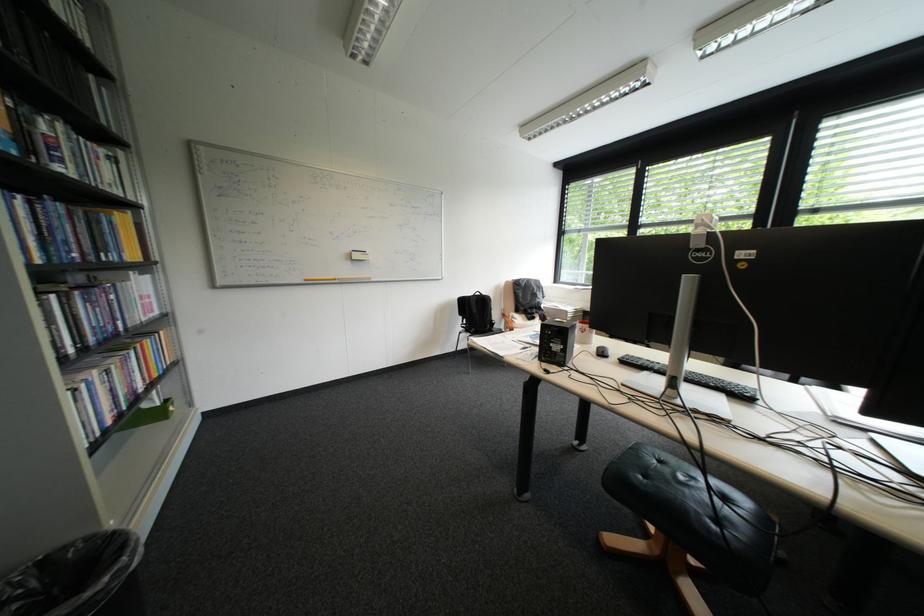
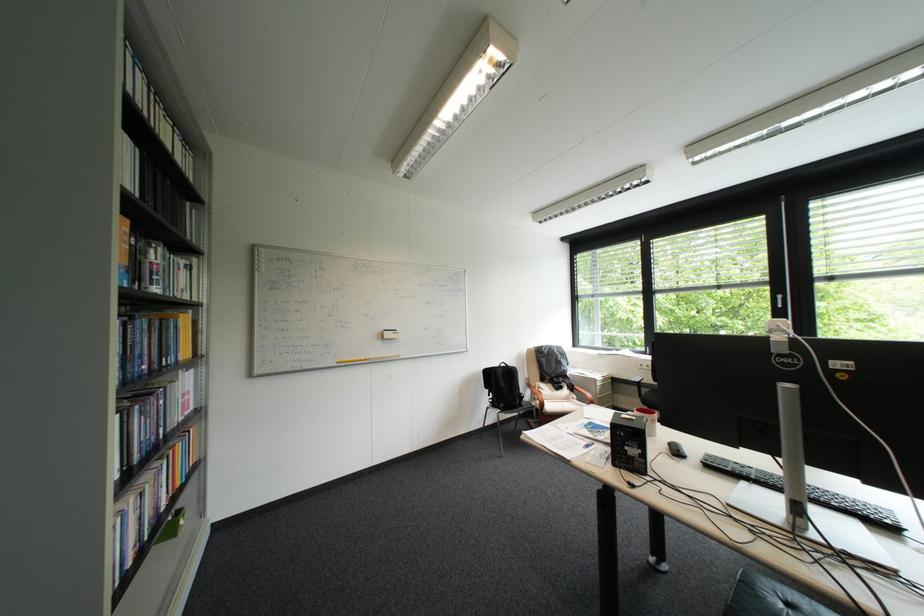
Where in the second image is the point corresponding to the point at 505,320 from the first image?

(533, 392)